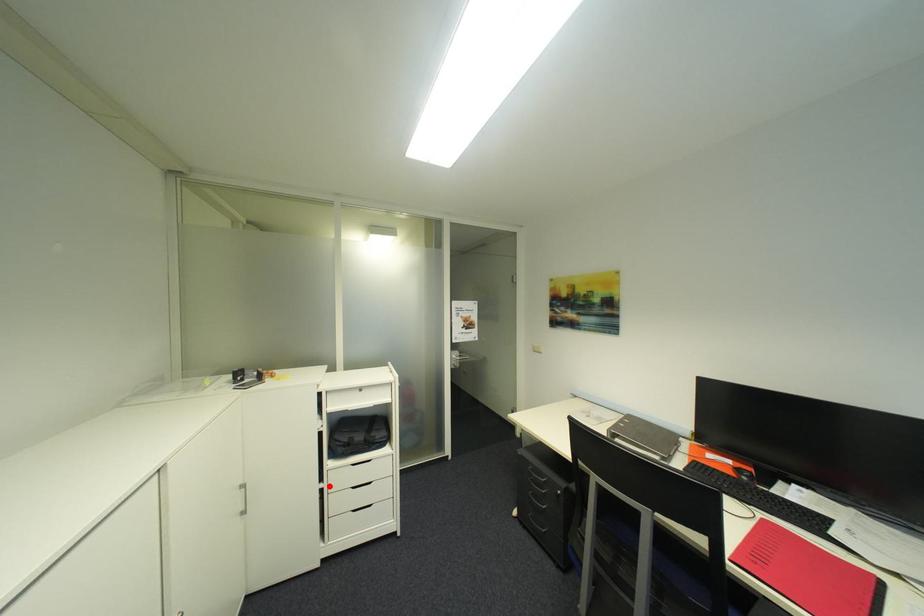
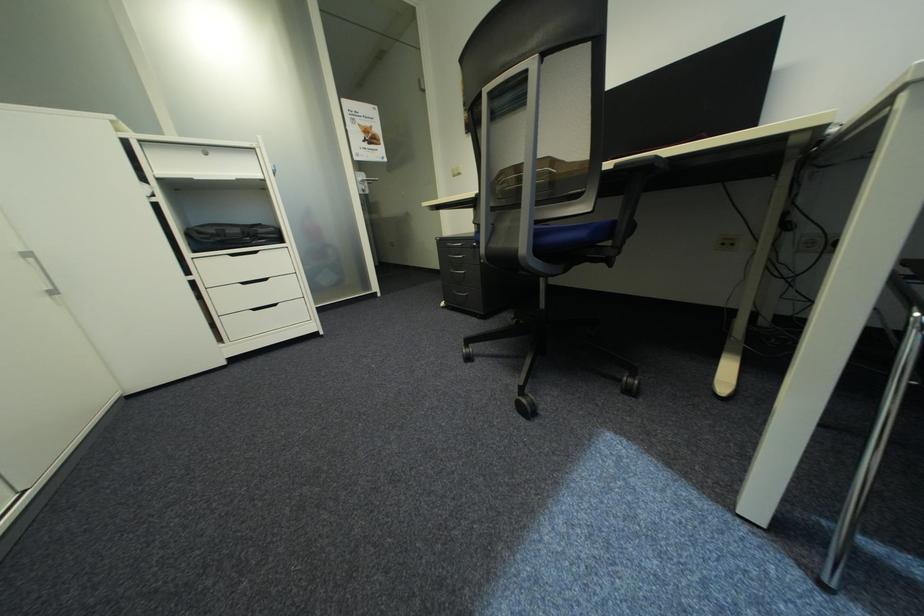
Question: I am providing you with two images of the same scene from different viewpoints. A red point is shown in image1. For the corresponding object point in image2, is it positioned nearer or farther from the camera?

Choices:
 (A) Nearer
 (B) Farther

Answer: (A)